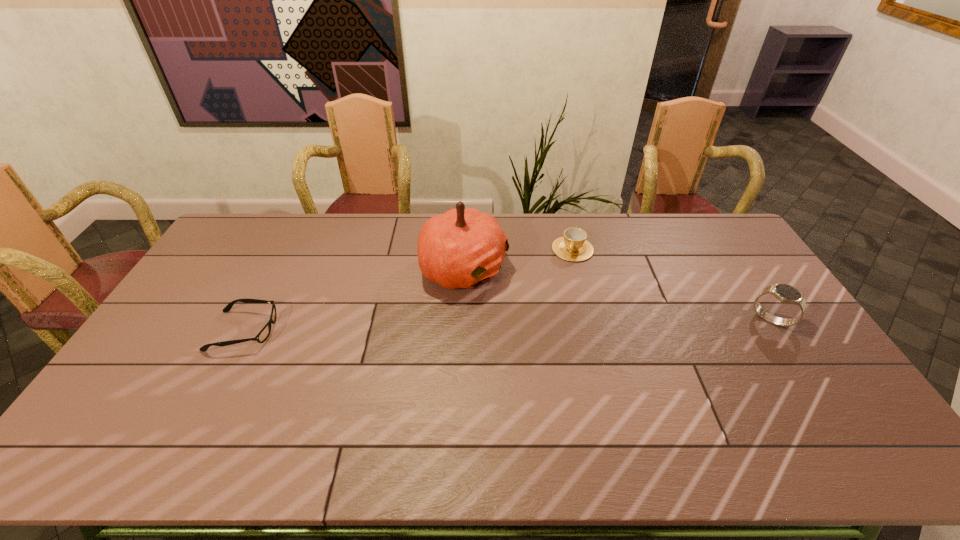
This screenshot has width=960, height=540. I want to click on spectacles, so click(x=262, y=336).

The image size is (960, 540). I want to click on the leftmost object, so click(x=262, y=336).

This screenshot has height=540, width=960. What are the coordinates of `watch` in the screenshot? It's located at (785, 293).

The image size is (960, 540). Find the location of `the rightmost object`. the rightmost object is located at coordinates (785, 293).

I want to click on the third object from right to left, so click(x=461, y=248).

Where is `pumpkin`? The height and width of the screenshot is (540, 960). pumpkin is located at coordinates (461, 248).

Locate an element on the screen. cup is located at coordinates (573, 246).

Identify the location of the second shortest object. (573, 246).

Image resolution: width=960 pixels, height=540 pixels. What are the coordinates of `vacant space positioned on the front-facing side of the leftmost object` in the screenshot? It's located at (359, 331).

Locate an element on the screen. The image size is (960, 540). vacant space located 0.250m on the left of the rightmost object is located at coordinates (670, 320).